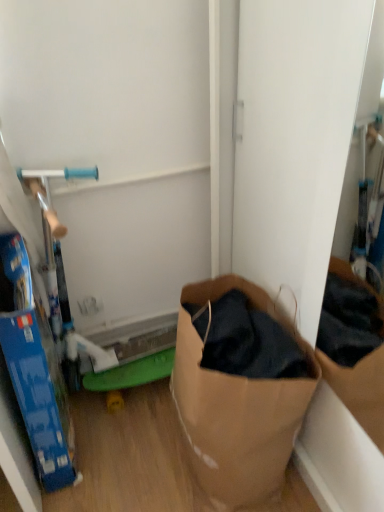
Question: Based on their sizes in the image, would you say blue cardboard box at left is bigger or smaller than brown paper bag at lower right?

Choices:
 (A) big
 (B) small

Answer: (B)

Question: Considering the positions of point (46, 336) and point (182, 358), is point (46, 336) closer or farther from the camera than point (182, 358)?

Choices:
 (A) closer
 (B) farther

Answer: (A)

Question: Is blue cardboard box at left taller or shorter than brown paper bag at lower right?

Choices:
 (A) tall
 (B) short

Answer: (A)

Question: From a real-world perspective, is brown paper bag at lower right positioned above or below blue cardboard box at left?

Choices:
 (A) above
 (B) below

Answer: (B)

Question: From the image's perspective, relative to blue cardboard box at left, is brown paper bag at lower right above or below?

Choices:
 (A) above
 (B) below

Answer: (B)

Question: Relative to blue cardboard box at left, is brown paper bag at lower right in front or behind?

Choices:
 (A) front
 (B) behind

Answer: (B)

Question: Considering the positions of point (284, 416) and point (44, 403), is point (284, 416) closer or farther from the camera than point (44, 403)?

Choices:
 (A) farther
 (B) closer

Answer: (B)